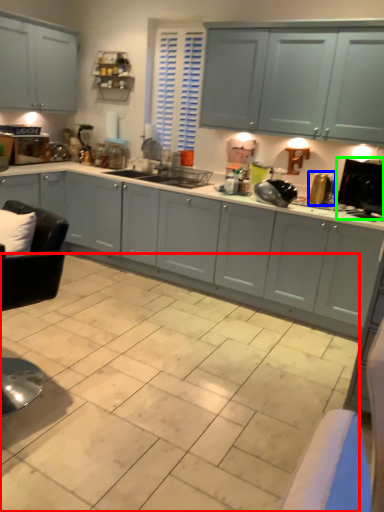
Question: Based on their relative distances, which object is farther from ceramic tile (highlighted by a red box)? Choose from appliance (highlighted by a blue box) and appliance (highlighted by a green box).

Choices:
 (A) appliance
 (B) appliance

Answer: (A)